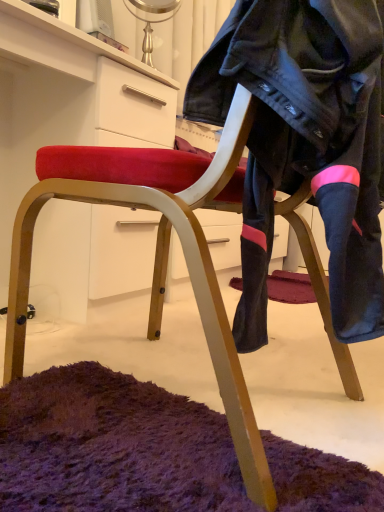
Question: From a real-world perspective, is velvet red chair at lower left above or below black leather jacket at center?

Choices:
 (A) below
 (B) above

Answer: (A)

Question: Visually, is velvet red chair at lower left positioned to the left or to the right of black leather jacket at center?

Choices:
 (A) left
 (B) right

Answer: (A)

Question: From the image's perspective, is velvet red chair at lower left above or below black leather jacket at center?

Choices:
 (A) below
 (B) above

Answer: (B)

Question: From the image's perspective, is black leather jacket at center positioned above or below velvet red chair at lower left?

Choices:
 (A) above
 (B) below

Answer: (B)

Question: Considering the positions of point (317, 40) and point (46, 250), is point (317, 40) closer or farther from the camera than point (46, 250)?

Choices:
 (A) closer
 (B) farther

Answer: (A)

Question: Is black leather jacket at center wider or thinner than velvet red chair at lower left?

Choices:
 (A) wide
 (B) thin

Answer: (B)

Question: Considering the positions of black leather jacket at center and velvet red chair at lower left in the image, is black leather jacket at center bigger or smaller than velvet red chair at lower left?

Choices:
 (A) big
 (B) small

Answer: (B)